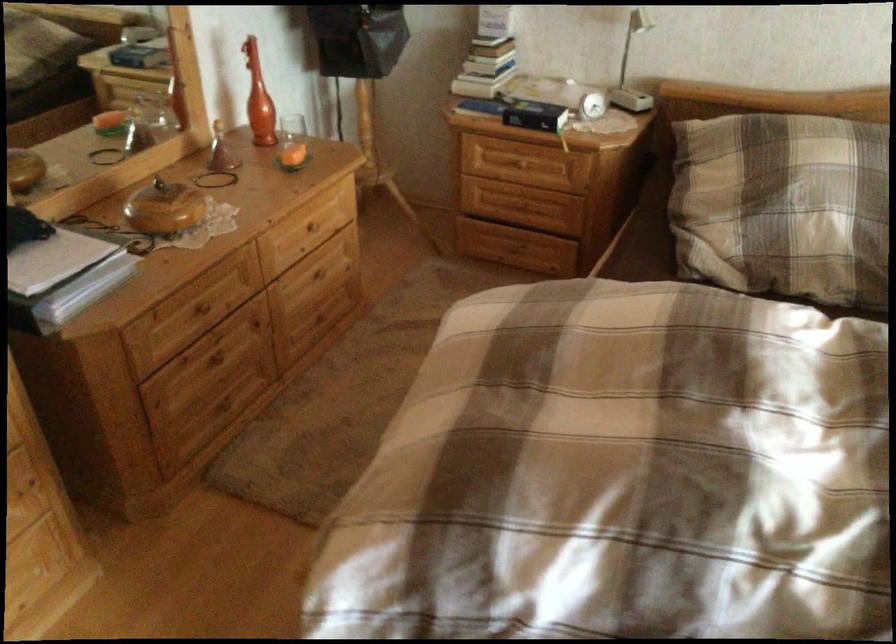
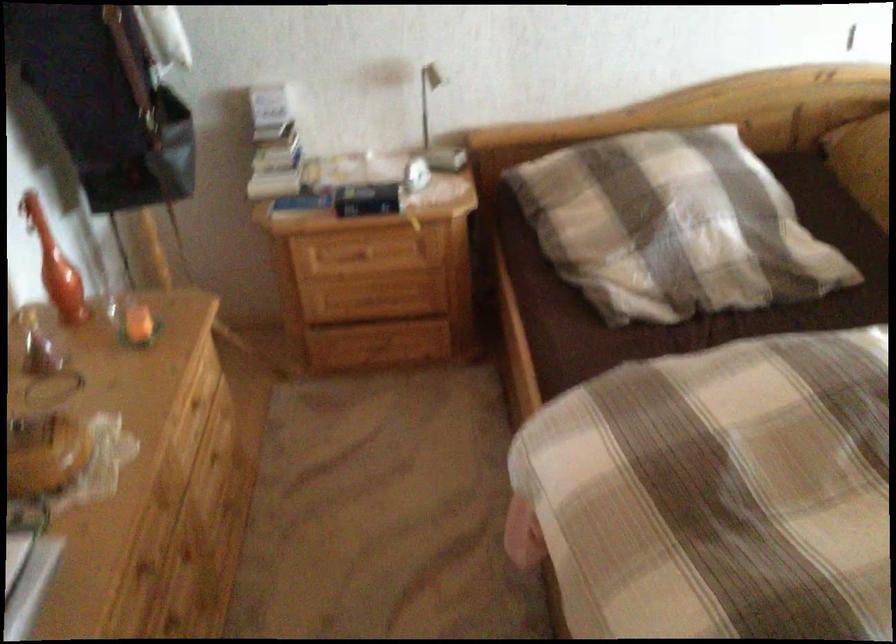
The point at (214, 362) is marked in the first image. Where is the corresponding point in the second image?

(174, 627)